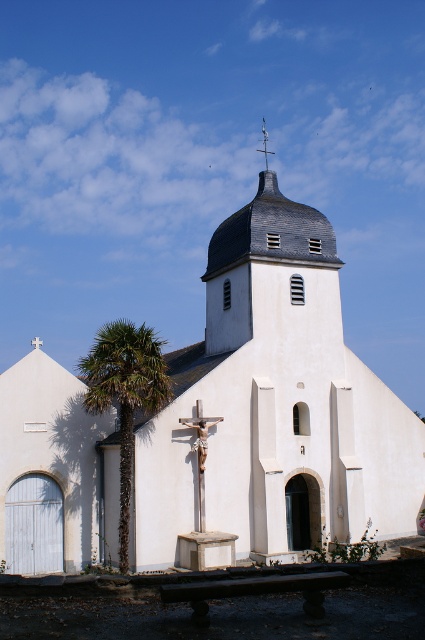
You are an architect planning to install a new light fixture between the white matte church at center and the polished silver spire at upper center. Which object should the light fixture be placed closer to if it needs to be at the same height as the spire?

The light fixture should be placed closer to the polished silver spire at upper center because the white matte church at center is taller than the polished silver spire at upper center. To match the spire height, positioning it nearer to the spire would ensure the light is at the same level as the spire.

You are standing at the entrance of the church and want to take a photo that includes both the green leafy palm tree at left and the white wooden cross at upper center. Which object will appear larger in the photo?

The green leafy palm tree at left will appear larger in the photo because it is much taller than the white wooden cross at upper center.

You are standing in front of the church and want to take a photo of both the green leafy palm tree at left and the polished silver spire at upper center. Which object should you position to your left side in the camera frame?

You should position the green leafy palm tree at left to your left side in the camera frame because it is already located to the left of the polished silver spire at upper center.